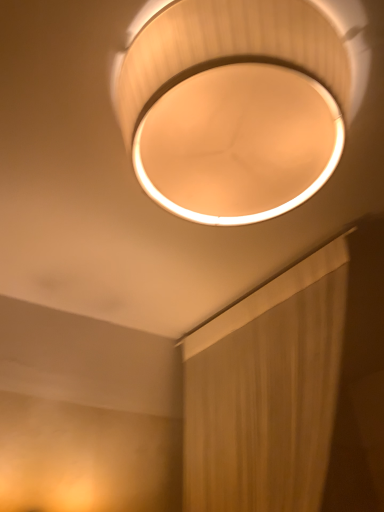
Measure the distance between point (368, 73) and camera.

Point (368, 73) and camera are 81.10 centimeters apart from each other.

This screenshot has height=512, width=384. In order to click on matte white lampshade at upper center in this screenshot , I will do `click(239, 102)`.

Image resolution: width=384 pixels, height=512 pixels. Describe the element at coordinates (239, 102) in the screenshot. I see `matte white lampshade at upper center` at that location.

Identify the location of matte white lampshade at upper center. (239, 102).